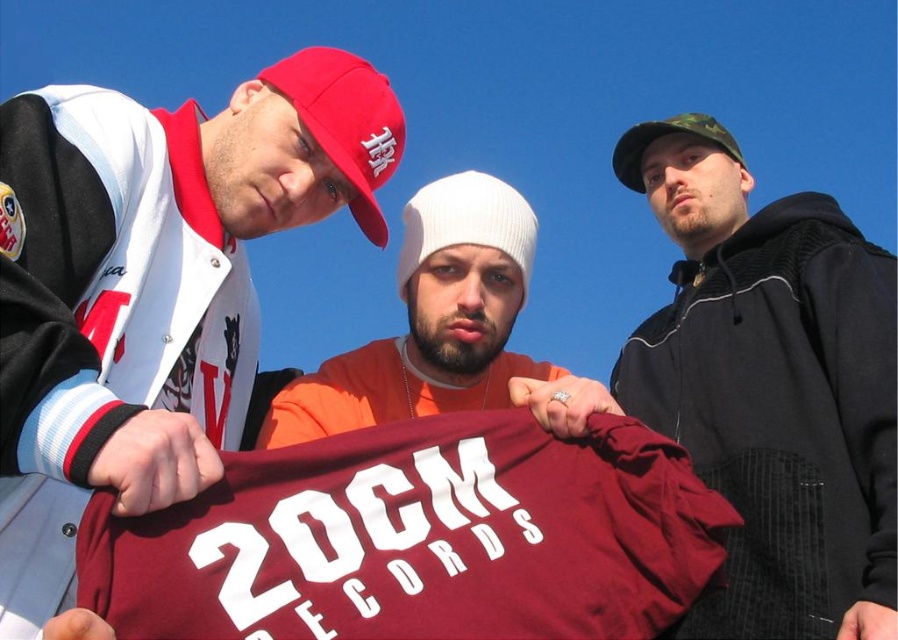
Question: Considering the relative positions of orange cotton shirt at center and matte red baseball cap at upper left in the image provided, where is orange cotton shirt at center located with respect to matte red baseball cap at upper left?

Choices:
 (A) left
 (B) right

Answer: (B)

Question: Based on their relative distances, which object is nearer to the camo fabric baseball cap at upper right?

Choices:
 (A) camo fabric cap at upper right
 (B) orange cotton shirt at center

Answer: (A)

Question: Can you confirm if orange cotton shirt at center is positioned to the right of camo fabric baseball cap at upper right?

Choices:
 (A) no
 (B) yes

Answer: (A)

Question: Which object is farther from the camera taking this photo?

Choices:
 (A) orange cotton shirt at center
 (B) camo fabric cap at upper right

Answer: (A)

Question: Which point appears closest to the camera in this image?

Choices:
 (A) (693, 120)
 (B) (315, 99)
 (C) (842, 369)
 (D) (7, 513)

Answer: (D)

Question: Can you confirm if camo fabric cap at upper right is wider than matte red baseball cap at upper left?

Choices:
 (A) no
 (B) yes

Answer: (B)